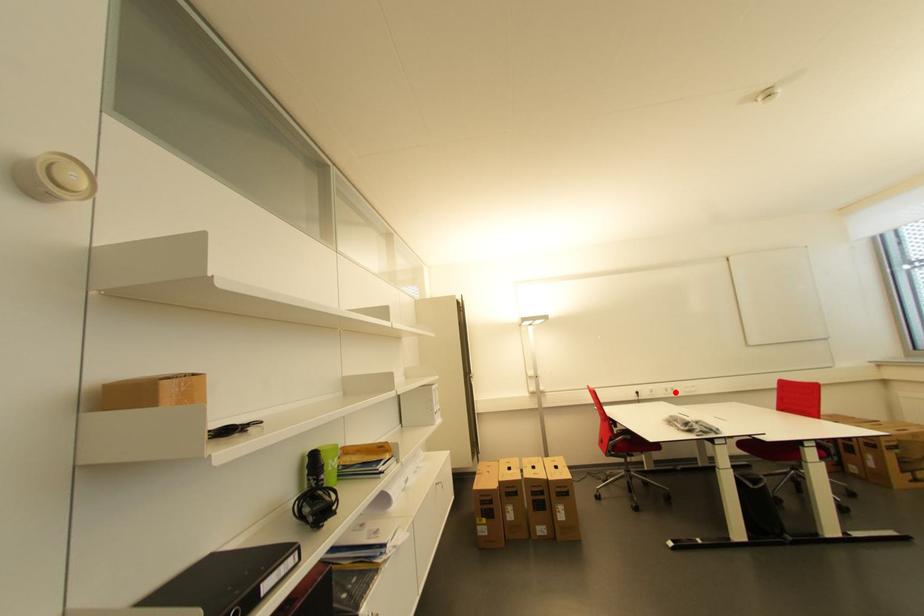
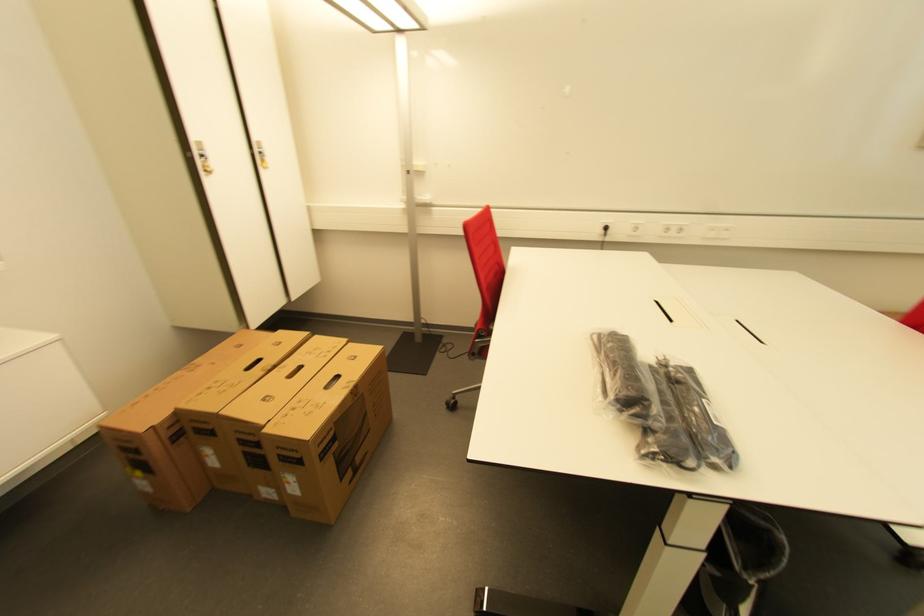
Where in the second image is the point corresponding to the highlighted location from the first image?

(676, 233)